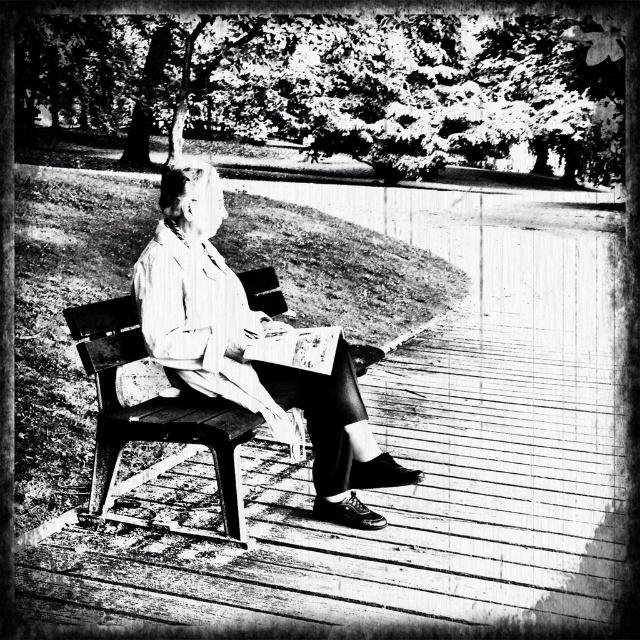
Question: Which of the following is the farthest from the observer?

Choices:
 (A) (310, 365)
 (B) (236, 528)
 (C) (170, 264)

Answer: (A)

Question: Is wooden bench at center smaller than paperback book at center?

Choices:
 (A) no
 (B) yes

Answer: (A)

Question: Which point is farther to the camera?

Choices:
 (A) pos(88,340)
 (B) pos(301,339)
 (C) pos(362,476)

Answer: (C)

Question: Is wooden bench at center above paperback book at center?

Choices:
 (A) yes
 (B) no

Answer: (B)

Question: Which point is closer to the camera?

Choices:
 (A) (196, 161)
 (B) (99, 483)
 (C) (282, 346)

Answer: (B)

Question: Is striped fabric coat at center below paperback book at center?

Choices:
 (A) no
 (B) yes

Answer: (A)